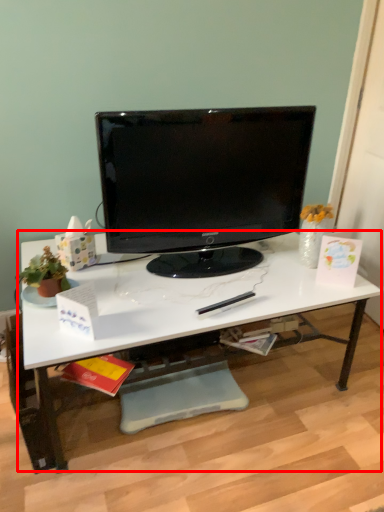
Question: From the image, what is the correct spatial relationship of desk (annotated by the red box) in relation to computer monitor?

Choices:
 (A) right
 (B) left

Answer: (B)